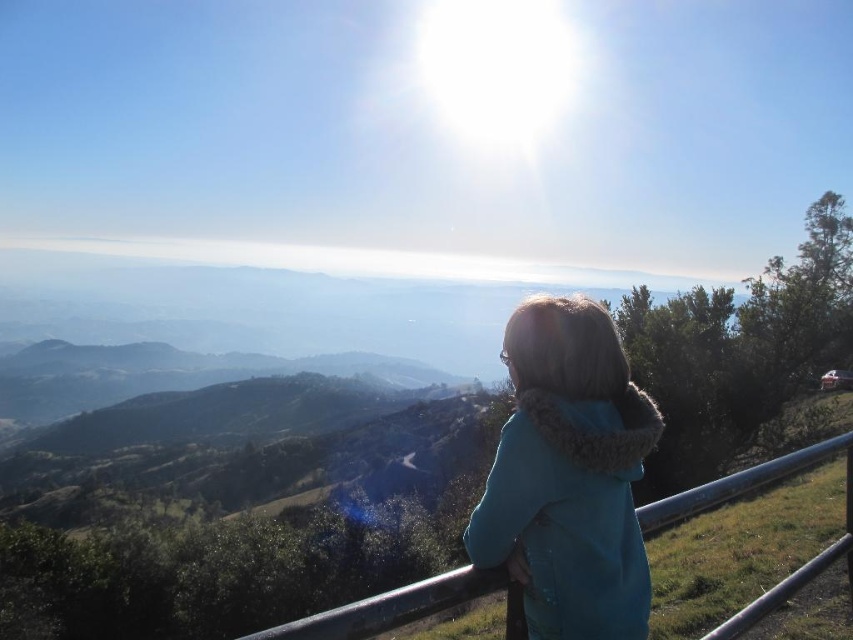
You are standing at the viewpoint and want to reach the point marked at coordinates point (549,636). If your walking speed is 1.5 meters per second, how long will it take you to reach that point?

The distance between you and the point (549,636) is 2.17 meters. At a speed of 1.5 meters per second, it will take approximately 1.45 seconds to reach the point.